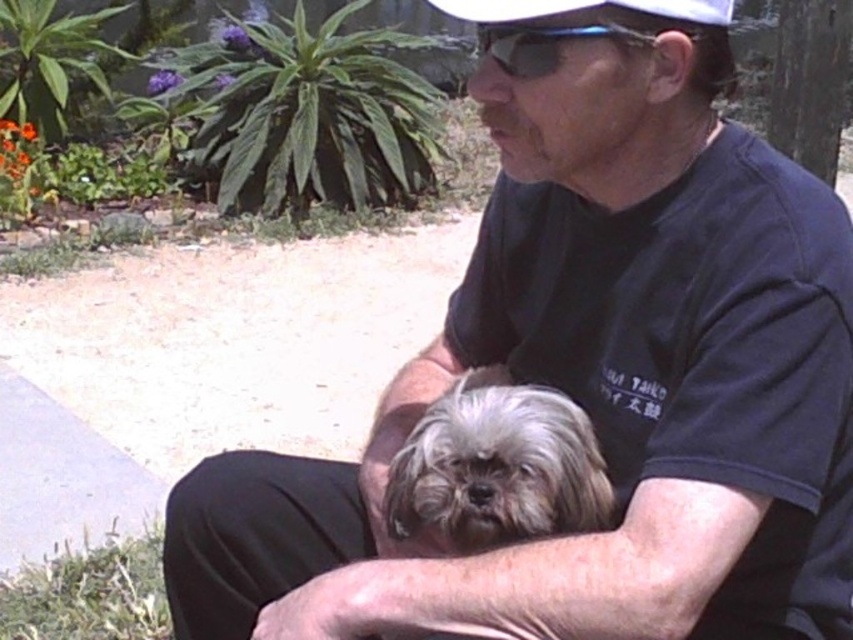
Question: Does fluffy gray fur at center have a smaller size compared to white matte baseball cap at upper center?

Choices:
 (A) yes
 (B) no

Answer: (B)

Question: Which object appears farthest from the camera in this image?

Choices:
 (A) fluffy gray fur at center
 (B) white matte baseball cap at upper center

Answer: (A)

Question: Among these points, which one is farthest from the camera?

Choices:
 (A) (457, 3)
 (B) (401, 504)

Answer: (B)

Question: Does fluffy gray fur at center appear on the right side of white matte baseball cap at upper center?

Choices:
 (A) yes
 (B) no

Answer: (B)

Question: Which point is farther to the camera?

Choices:
 (A) (403, 452)
 (B) (695, 10)

Answer: (A)

Question: Does fluffy gray fur at center lie behind white matte baseball cap at upper center?

Choices:
 (A) yes
 (B) no

Answer: (A)